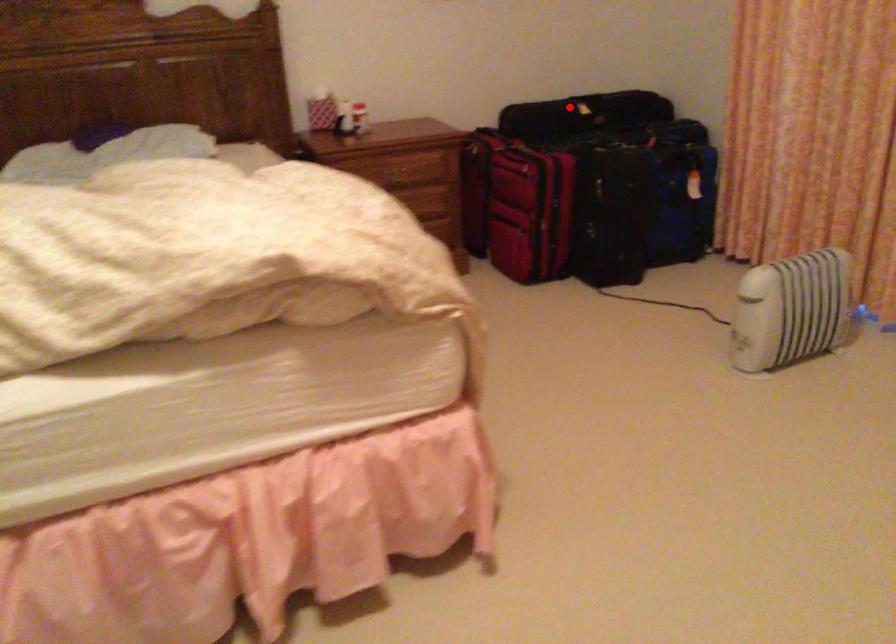
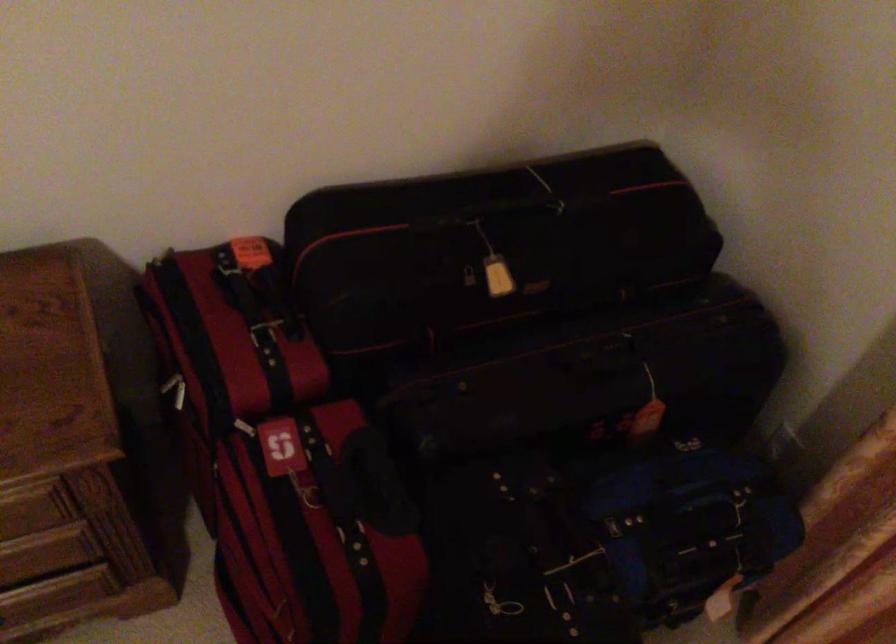
The point at the highlighted location is marked in the first image. Where is the corresponding point in the second image?

(470, 287)